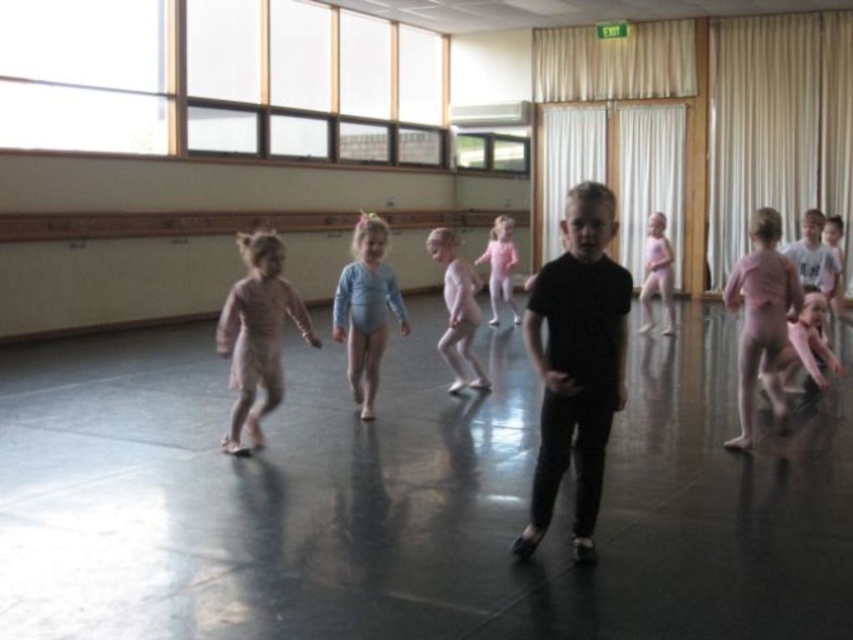
Between matte pink leotard at center and pink leotard at center, which one has more height?

With more height is pink leotard at center.

Describe the element at coordinates (457, 308) in the screenshot. I see `matte pink leotard at center` at that location.

Between point (471, 385) and point (498, 262), which one is positioned in front?

Point (471, 385)

Locate an element on the screen. Image resolution: width=853 pixels, height=640 pixels. matte pink leotard at center is located at coordinates (457, 308).

Can you confirm if pink satin dress at center is smaller than pink matte leotard at right?

Indeed, pink satin dress at center has a smaller size compared to pink matte leotard at right.

What do you see at coordinates (257, 333) in the screenshot?
I see `pink satin dress at center` at bounding box center [257, 333].

Does point (252, 371) come farther from viewer compared to point (730, 301)?

No, it is not.

Where is `pink satin dress at center`? pink satin dress at center is located at coordinates (257, 333).

Between pink matte leotard at right and pink leotard at center, which one appears on the right side from the viewer's perspective?

pink matte leotard at right

Is pink matte leotard at right bigger than pink leotard at center?

Yes.

Between point (775, 262) and point (474, 260), which one is positioned behind?

The point (474, 260) is behind.

You are a GUI agent. You are given a task and a screenshot of the screen. Output one action in this format:
    pyautogui.click(x=<x>, y=<y>)
    Task: Click on the pink matte leotard at right
    This screenshot has width=853, height=640.
    Given the screenshot: What is the action you would take?
    pyautogui.click(x=761, y=317)